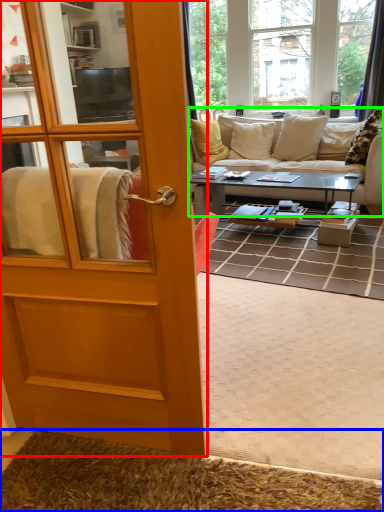
Question: Which object is positioned closest to door (highlighted by a red box)? Select from doormat (highlighted by a blue box) and studio couch (highlighted by a green box).

Choices:
 (A) doormat
 (B) studio couch

Answer: (A)